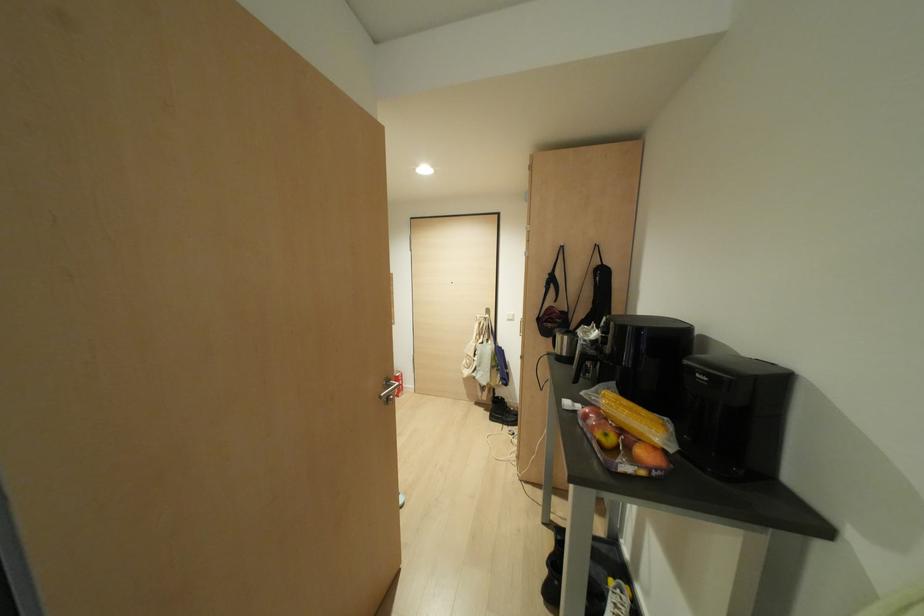
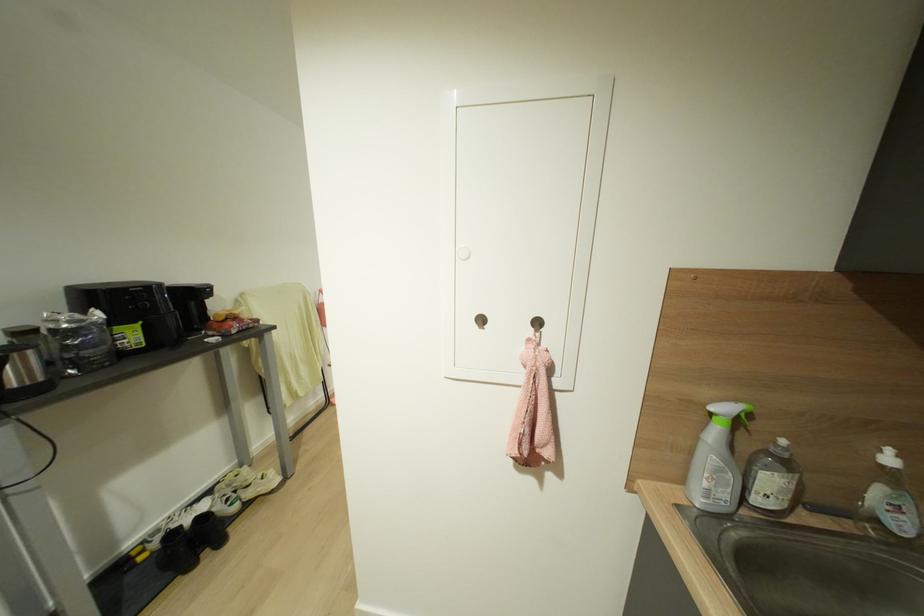
Question: I am providing you with two images of the same scene from different viewpoints. Which of the following objects are not visible in image2?

Choices:
 (A) white bottle pump
 (B) white wall dial
 (C) black appliance lid
 (D) silver electric kettle

Answer: (C)